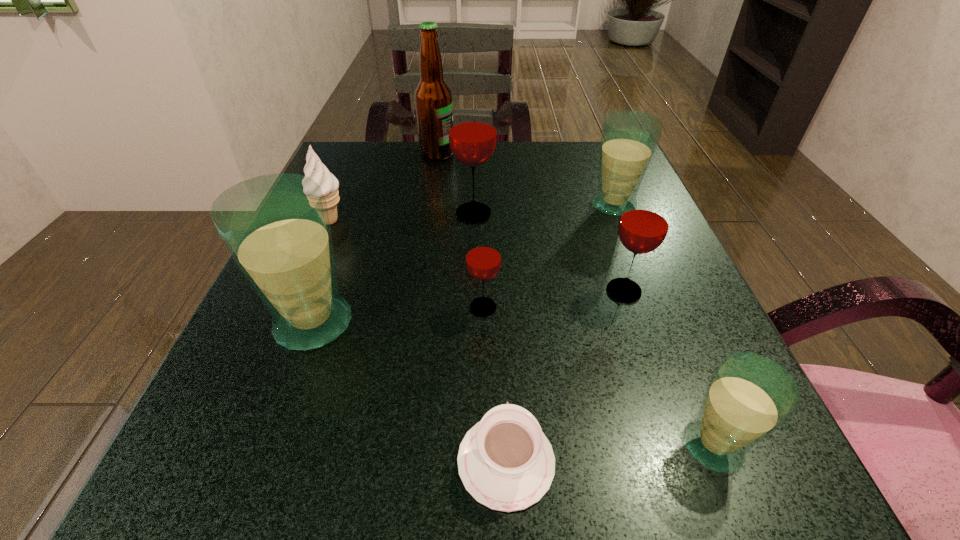
Identify the location of object at the near right corner. Image resolution: width=960 pixels, height=540 pixels. (749, 396).

In the image, there is a desktop. Where is `vacant region at the far edge`? Image resolution: width=960 pixels, height=540 pixels. vacant region at the far edge is located at coordinates (492, 166).

What are the coordinates of `vacant space at the near edge of the desktop` in the screenshot? It's located at (391, 485).

The width and height of the screenshot is (960, 540). In the image, there is a desktop. What are the coordinates of `blank space at the left edge` in the screenshot? It's located at (266, 435).

In the image, there is a desktop. Identify the location of vacant area at the right edge. This screenshot has height=540, width=960. (677, 375).

The image size is (960, 540). What are the coordinates of `vacant space at the far left corner of the desktop` in the screenshot? It's located at (356, 154).

In the image, there is a desktop. Where is `vacant space at the far right corner`? This screenshot has height=540, width=960. vacant space at the far right corner is located at coordinates (592, 174).

The width and height of the screenshot is (960, 540). What are the coordinates of `vacant area that lies between the third object from left to right and the rightmost red glass` in the screenshot? It's located at (531, 222).

Find the location of `vacant region between the tallest object and the nearest blue glass`. vacant region between the tallest object and the nearest blue glass is located at coordinates (575, 300).

Identify the location of empty space between the nearest glass and the teacup. (610, 453).